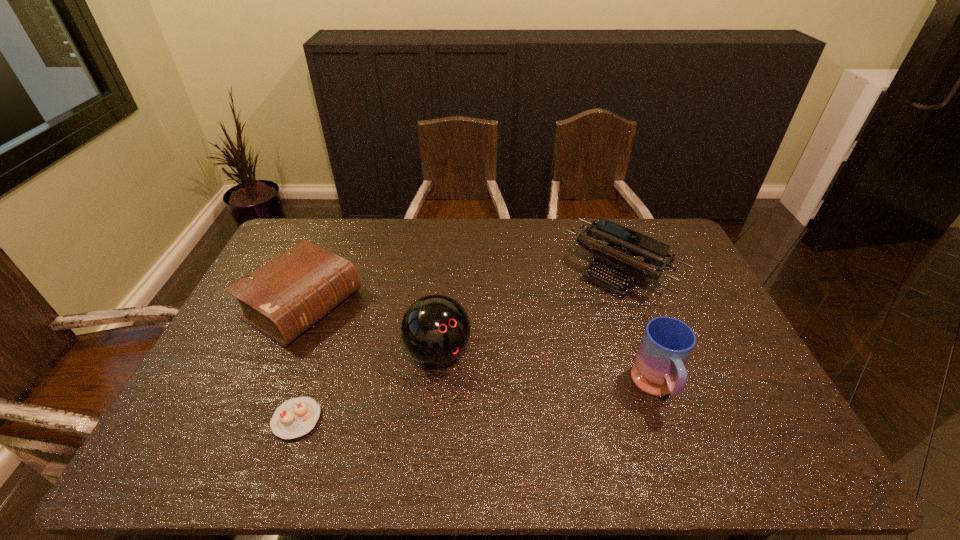
Identify the location of object that is at the far right corner. This screenshot has height=540, width=960. (614, 252).

At what (x,y) coordinates should I click in order to perform the action: click on free space at the far edge of the desktop. Please return your answer as a coordinate pair (x, y). Image resolution: width=960 pixels, height=540 pixels. Looking at the image, I should click on (580, 250).

Where is `vacant space at the near edge of the desktop`? This screenshot has width=960, height=540. vacant space at the near edge of the desktop is located at coordinates (457, 413).

I want to click on free location at the left edge, so coord(258,350).

In the image, there is a desktop. Identify the location of free space at the right edge. (735, 334).

This screenshot has width=960, height=540. What are the coordinates of `vacant space at the far left corner of the desktop` in the screenshot? It's located at (289, 233).

Locate an element on the screen. The width and height of the screenshot is (960, 540). free space between the cupcake and the third object from left to right is located at coordinates (368, 386).

What are the coordinates of `vacant region between the typewriter and the fourth tallest object` in the screenshot? It's located at (462, 288).

In order to click on vacant point located between the cupcake and the second shortest object in this screenshot , I will do `click(300, 362)`.

This screenshot has width=960, height=540. In order to click on unoccupied area between the bowling ball and the second shortest object in this screenshot , I will do `click(371, 329)`.